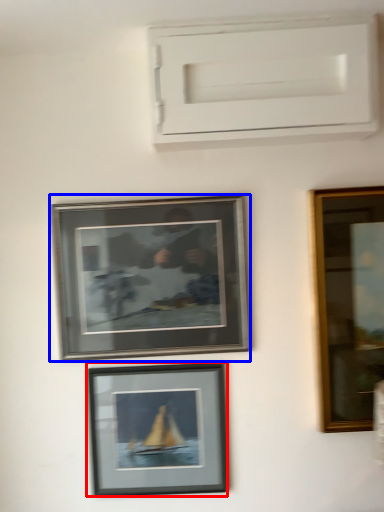
Question: Which of the following is the farthest to the observer, picture frame (highlighted by a red box) or picture frame (highlighted by a blue box)?

Choices:
 (A) picture frame
 (B) picture frame

Answer: (A)